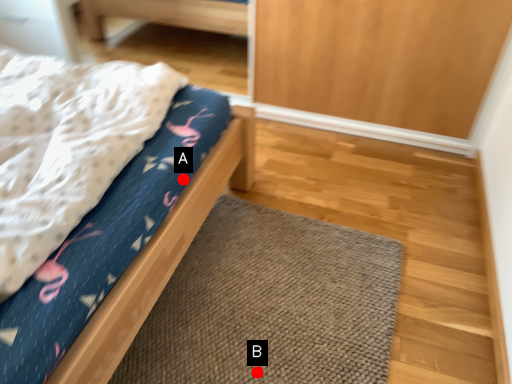
Question: Two points are circled on the image, labeled by A and B beside each circle. Which point is closer to the camera?

Choices:
 (A) A is closer
 (B) B is closer

Answer: (B)